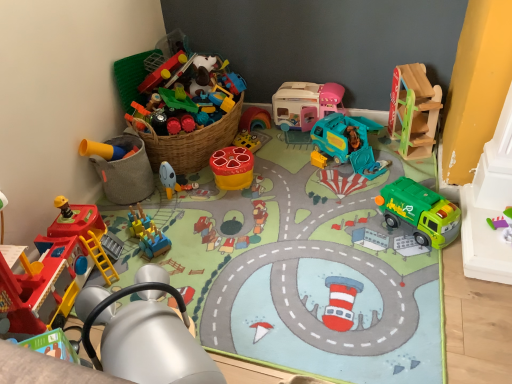
Identify the location of free space that is in between pastel pink plastic camper at center, marked as the sixth toy in a left-to-right arrangement, and blue plastic train at center, which appears as the 2th toy when viewed from the left. The width and height of the screenshot is (512, 384). (237, 191).